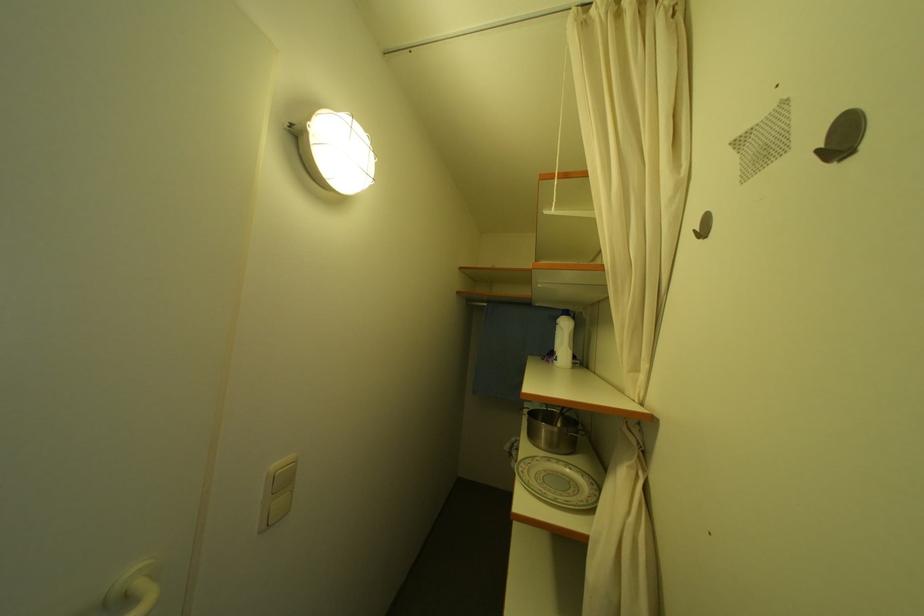
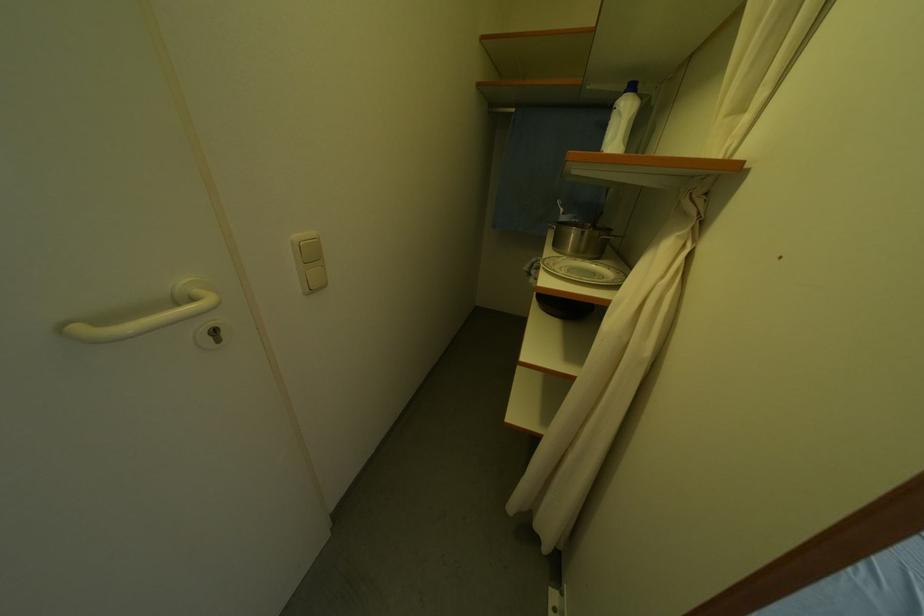
In the second image, find the point that corresponds to pixel 570 416 in the first image.

(602, 228)